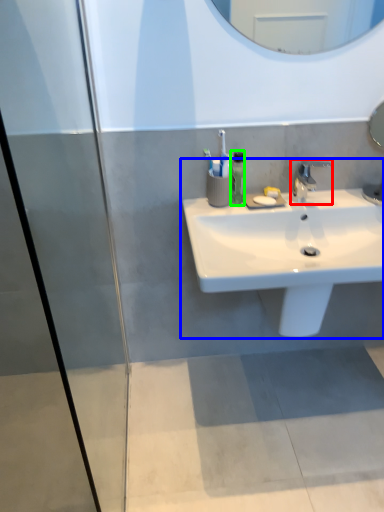
Question: Which object is positioned closest to tap (highlighted by a red box)? Select from sink (highlighted by a blue box) and soap dispenser (highlighted by a green box).

Choices:
 (A) sink
 (B) soap dispenser

Answer: (B)